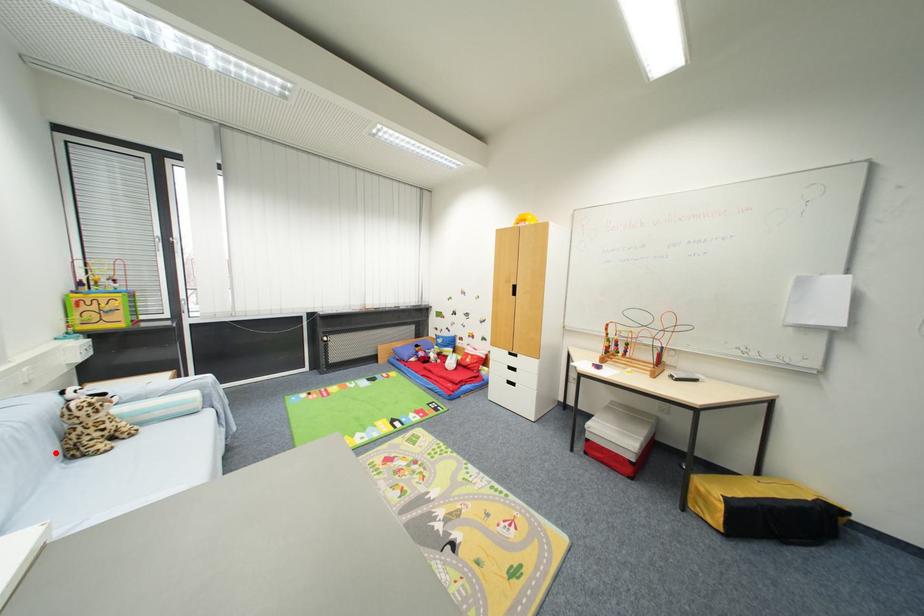
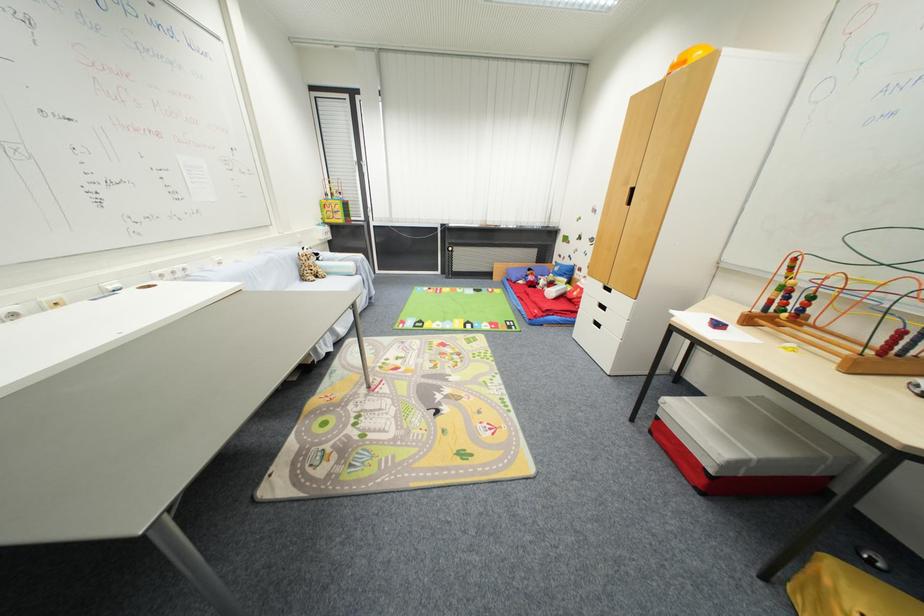
In the second image, find the point that corresponds to the highlighted location in the first image.

(300, 276)